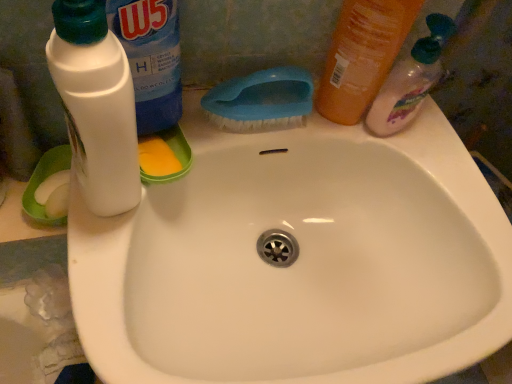
Locate an element on the screen. The width and height of the screenshot is (512, 384). vacant space to the right of blue plastic brush at upper center is located at coordinates (378, 147).